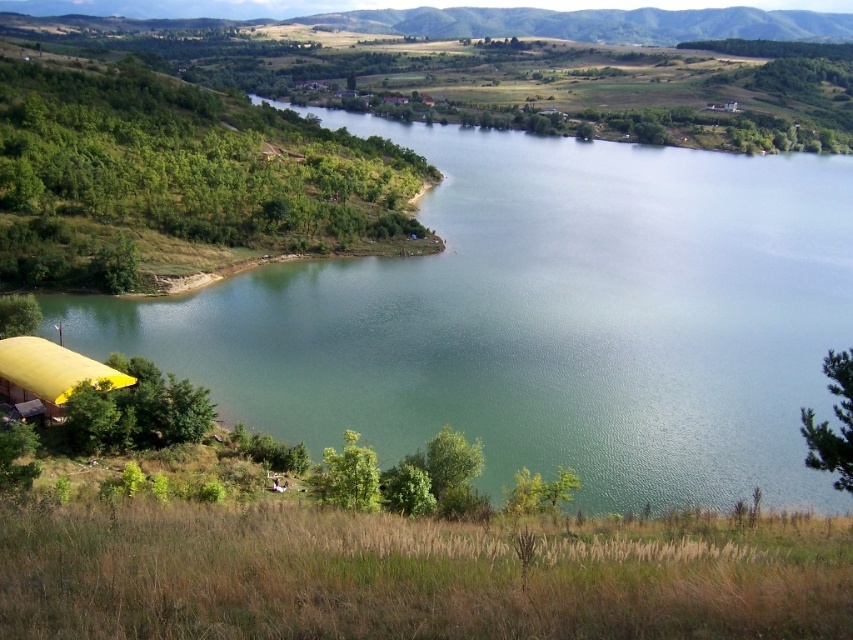
Question: Which of the following is the farthest from the observer?

Choices:
 (A) green water at center
 (B) yellow fabric tent at lower left

Answer: (B)

Question: Does green water at center appear over yellow fabric tent at lower left?

Choices:
 (A) yes
 (B) no

Answer: (A)

Question: Among these points, which one is nearest to the camera?

Choices:
 (A) (576, 314)
 (B) (25, 412)

Answer: (B)

Question: From the image, what is the correct spatial relationship of green water at center in relation to yellow fabric tent at lower left?

Choices:
 (A) left
 (B) right

Answer: (B)

Question: Does green water at center have a greater width compared to yellow fabric tent at lower left?

Choices:
 (A) no
 (B) yes

Answer: (B)